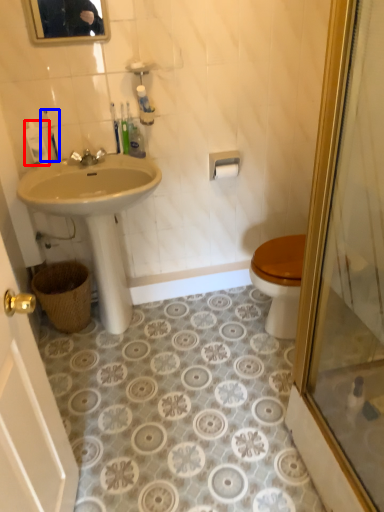
Question: Which object is further to the camera taking this photo, toiletry (highlighted by a red box) or toiletry (highlighted by a blue box)?

Choices:
 (A) toiletry
 (B) toiletry

Answer: (A)